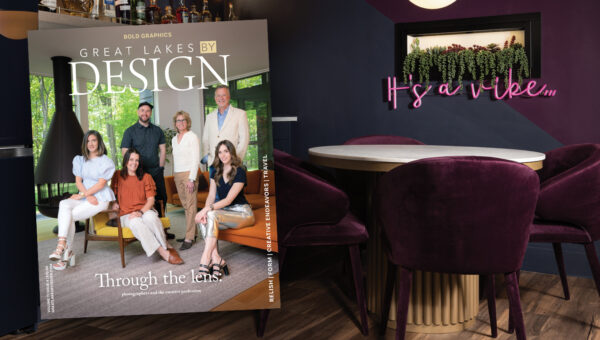
The width and height of the screenshot is (600, 340). In order to click on light in this screenshot , I will do `click(436, 2)`.